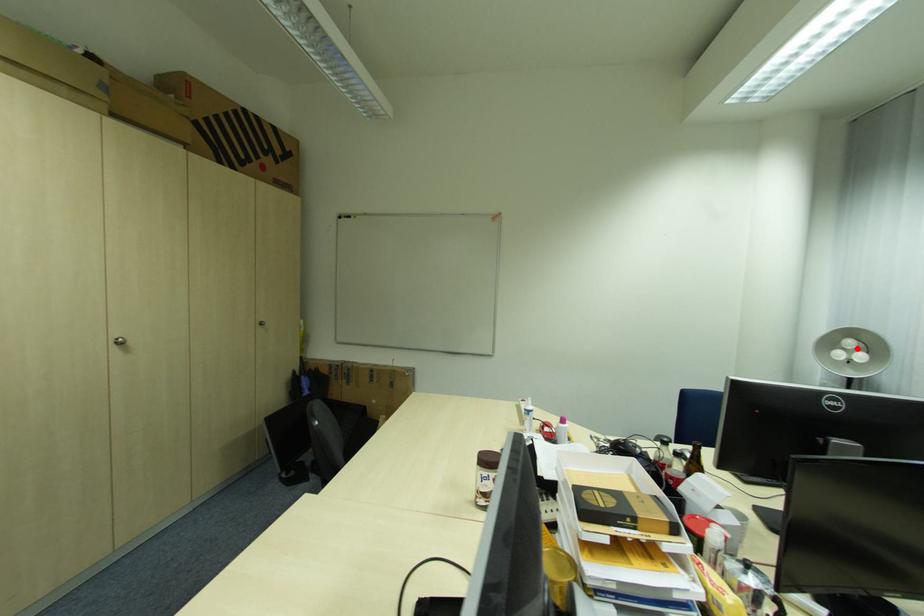
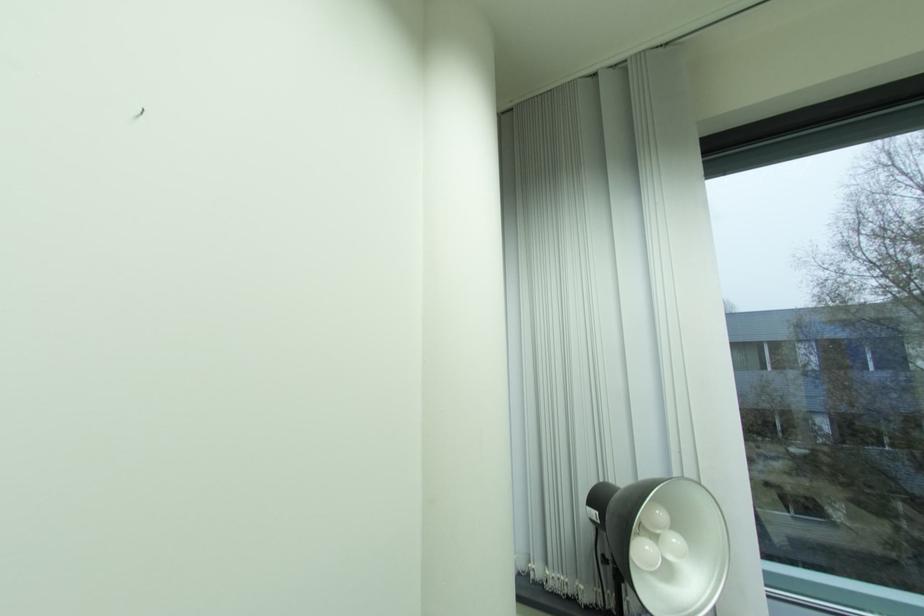
Locate, in the second image, the point that corresponds to the highlighted location in the first image.

(665, 531)